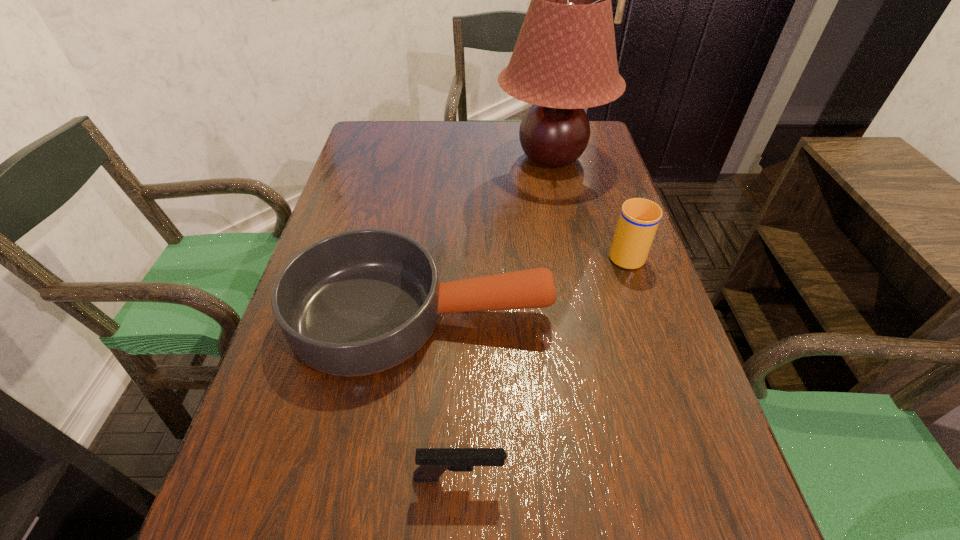
Identify the location of the farthest object. (564, 60).

At what (x,y) coordinates should I click in order to perform the action: click on lampshade. Please return your answer as a coordinate pair (x, y). The height and width of the screenshot is (540, 960). Looking at the image, I should click on (564, 60).

Where is `the third shortest object`? the third shortest object is located at coordinates (639, 218).

Find the location of a particular element. The width and height of the screenshot is (960, 540). pan is located at coordinates (359, 302).

This screenshot has width=960, height=540. Identify the location of the shortest object. (433, 462).

The image size is (960, 540). I want to click on pistol, so click(x=433, y=462).

Where is `vacant area situated 0.390m on the front-facing side of the farthest object`? This screenshot has height=540, width=960. vacant area situated 0.390m on the front-facing side of the farthest object is located at coordinates (365, 158).

Image resolution: width=960 pixels, height=540 pixels. Find the location of `vacant region located on the front-facing side of the farthest object`. vacant region located on the front-facing side of the farthest object is located at coordinates pos(398,158).

The width and height of the screenshot is (960, 540). Find the location of `vacant space located on the front-facing side of the farthest object`. vacant space located on the front-facing side of the farthest object is located at coordinates point(361,158).

Where is `vacant space located 0.150m on the side of the cup with the handle`? vacant space located 0.150m on the side of the cup with the handle is located at coordinates (607, 199).